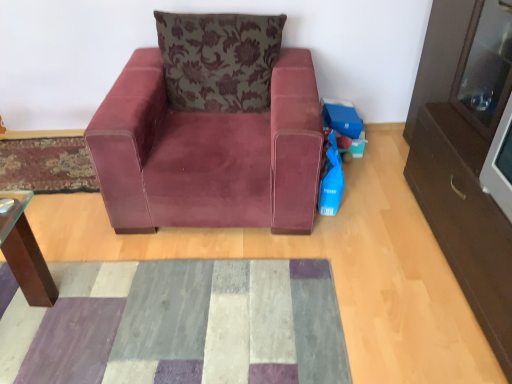
Question: Is blue plastic toy at lower right turned away from patchwork fabric mat at center, placed as the first mat when sorted from bottom to top?

Choices:
 (A) yes
 (B) no

Answer: (B)

Question: From the image's perspective, is blue plastic toy at lower right located beneath patchwork fabric mat at center, which ranks as the second mat in left-to-right order?

Choices:
 (A) yes
 (B) no

Answer: (B)

Question: Is blue plastic toy at lower right positioned before patchwork fabric mat at center, which ranks as the second mat in left-to-right order?

Choices:
 (A) yes
 (B) no

Answer: (B)

Question: Considering the relative sizes of blue plastic toy at lower right and patchwork fabric mat at center, placed as the 2th mat when sorted from top to bottom, in the image provided, is blue plastic toy at lower right smaller than patchwork fabric mat at center, placed as the 2th mat when sorted from top to bottom,?

Choices:
 (A) yes
 (B) no

Answer: (A)

Question: Are blue plastic toy at lower right and patchwork fabric mat at center, which is the 2th mat in back-to-front order, making contact?

Choices:
 (A) yes
 (B) no

Answer: (B)

Question: In terms of width, does patchwork fabric mat at center, placed as the first mat when sorted from bottom to top, look wider or thinner when compared to velvet maroon armchair at center?

Choices:
 (A) thin
 (B) wide

Answer: (A)

Question: Does point (124, 334) appear closer or farther from the camera than point (307, 208)?

Choices:
 (A) farther
 (B) closer

Answer: (B)

Question: Is patchwork fabric mat at center, placed as the 2th mat when sorted from top to bottom, situated inside velvet maroon armchair at center or outside?

Choices:
 (A) inside
 (B) outside

Answer: (B)

Question: From the image's perspective, is patchwork fabric mat at center, placed as the first mat when sorted from bottom to top, positioned above or below velvet maroon armchair at center?

Choices:
 (A) below
 (B) above

Answer: (A)

Question: From the image's perspective, is velvet-like rug at lower left, which appears as the 1th mat when viewed from the left, positioned above or below patchwork fabric mat at center, the first mat in the right-to-left sequence?

Choices:
 (A) above
 (B) below

Answer: (A)

Question: Considering the positions of point (73, 185) and point (67, 279), is point (73, 185) closer or farther from the camera than point (67, 279)?

Choices:
 (A) farther
 (B) closer

Answer: (A)

Question: Looking at their shapes, would you say velvet-like rug at lower left, the 1th mat in the back-to-front sequence, is wider or thinner than patchwork fabric mat at center, which is counted as the first mat, starting from the front?

Choices:
 (A) thin
 (B) wide

Answer: (A)

Question: Which is correct: velvet-like rug at lower left, the 2th mat ordered from the bottom, is inside patchwork fabric mat at center, the first mat in the right-to-left sequence, or outside of it?

Choices:
 (A) outside
 (B) inside

Answer: (A)

Question: From a real-world perspective, is velvet floral pillow at upper center above or below velvet-like rug at lower left, the 1th mat in the back-to-front sequence?

Choices:
 (A) above
 (B) below

Answer: (A)

Question: Is velvet floral pillow at upper center to the left or to the right of velvet-like rug at lower left, the second mat viewed from the front, in the image?

Choices:
 (A) left
 (B) right

Answer: (B)